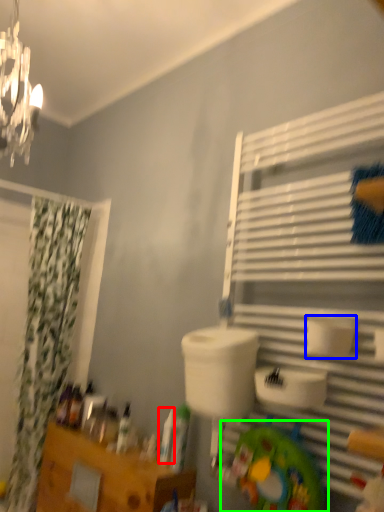
Question: Estimate the real-world distances between objects in this image. Which object is farther from toiletry (highlighted by a red box), toilet paper (highlighted by a blue box) or toy (highlighted by a green box)?

Choices:
 (A) toilet paper
 (B) toy

Answer: (A)